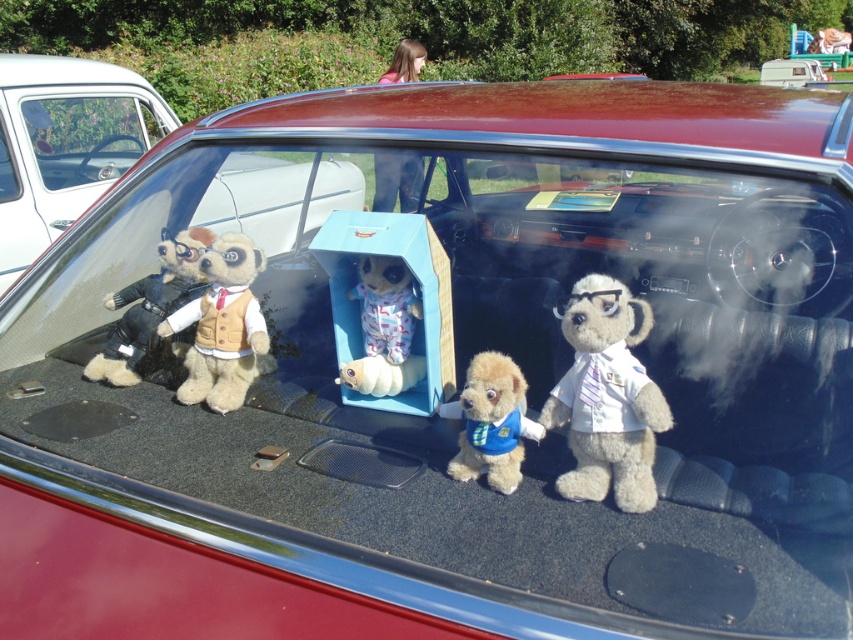
In the scene shown: Can you confirm if transparent glass at upper left is positioned above transparent plastic window at center?

Correct, transparent glass at upper left is located above transparent plastic window at center.

Is transparent glass at upper left wider than transparent plastic window at center?

Correct, the width of transparent glass at upper left exceeds that of transparent plastic window at center.

Which is in front, point (131, 115) or point (9, 200)?

Positioned in front is point (9, 200).

You are a GUI agent. You are given a task and a screenshot of the screen. Output one action in this format:
    pyautogui.click(x=<x>, y=<y>)
    Task: Click on the transparent glass at upper left
    Image resolution: width=853 pixels, height=640 pixels.
    Given the screenshot: What is the action you would take?
    pyautogui.click(x=86, y=136)

Is fuzzy beige teddy bear at center wider than velvet teddy bear at left?

In fact, fuzzy beige teddy bear at center might be narrower than velvet teddy bear at left.

Does fuzzy beige teddy bear at center appear over velvet teddy bear at left?

No.

Where is `fuzzy beige teddy bear at center`? fuzzy beige teddy bear at center is located at coordinates (223, 326).

I want to click on fuzzy beige teddy bear at center, so click(x=223, y=326).

Is fluffy beige dog at center behind transparent plastic window at center?

No, fluffy beige dog at center is closer to the viewer.

Is point (503, 400) less distant than point (1, 115)?

That is True.

Where is `fluffy beige dog at center`? The image size is (853, 640). fluffy beige dog at center is located at coordinates (491, 422).